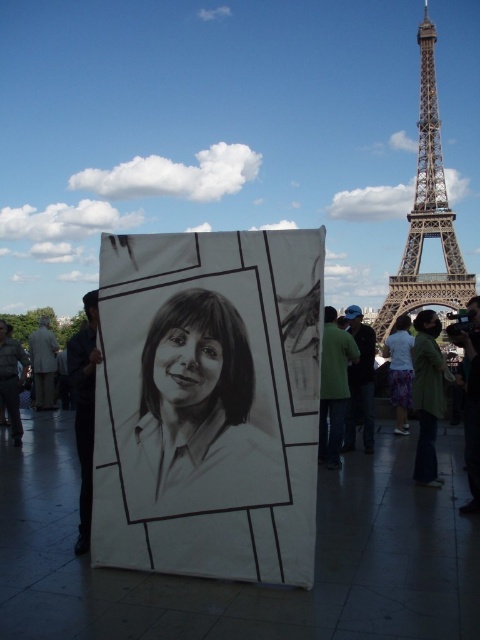
Consider the image. You are standing in front of the Eiffel Tower and see the pencil sketch portrait at center. If you want to take a photo of the Eiffel Tower without the portrait blocking the view, where should you move relative to the portrait?

The pencil sketch portrait at center is located at point [197,417], so moving to the left side of the portrait would allow you to capture the Eiffel Tower without obstruction.

You are an art student standing in front of the Eiffel Tower. You have a pencil sketch portrait at center and a brown metal eiffel tower at right in your view. Which object is positioned lower in the scene?

The pencil sketch portrait at center is located below the brown metal eiffel tower at right, so the pencil sketch portrait at center is positioned lower in the scene.